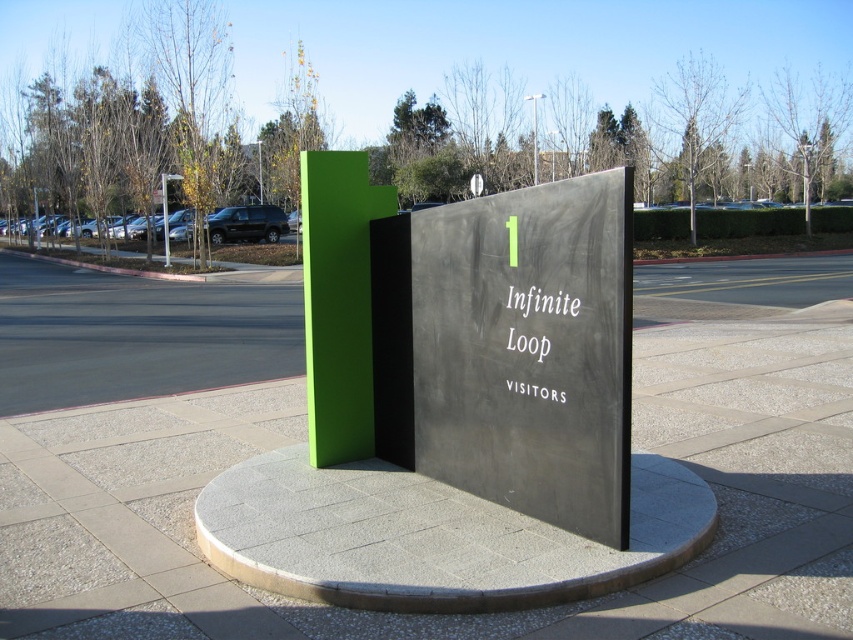
Question: Based on their relative distances, which object is farther from the metallic pole at center?

Choices:
 (A) metallic pole at upper center
 (B) whitematerial/textureinfinite loop visitors at center

Answer: (B)

Question: Which point is farther to the camera?

Choices:
 (A) (421, 268)
 (B) (201, 364)
 (C) (578, 305)
 (D) (537, 182)

Answer: (D)

Question: Which point appears farthest from the camera in this image?

Choices:
 (A) (814, 582)
 (B) (535, 161)
 (C) (561, 394)
 (D) (561, 518)

Answer: (B)

Question: Can you confirm if gray concrete pavement at center is thinner than whitematerial/textureinfinite loop visitors at center?

Choices:
 (A) yes
 (B) no

Answer: (B)

Question: Is black polished stone sign at center positioned in front of metallic pole at center?

Choices:
 (A) no
 (B) yes

Answer: (B)

Question: Is black polished stone sign at center to the left of whitematerial/textureinfinite loop visitors at center from the viewer's perspective?

Choices:
 (A) yes
 (B) no

Answer: (A)